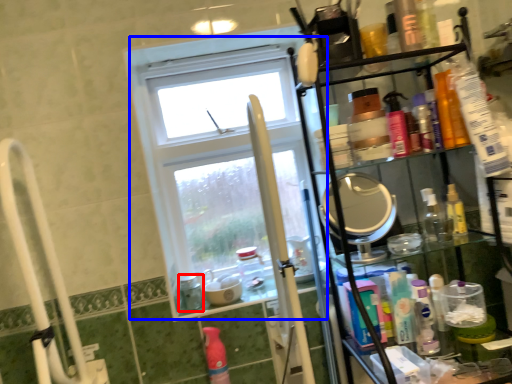
Question: Among these objects, which one is nearest to the camera, bottle (highlighted by a red box) or window (highlighted by a blue box)?

Choices:
 (A) bottle
 (B) window

Answer: (A)